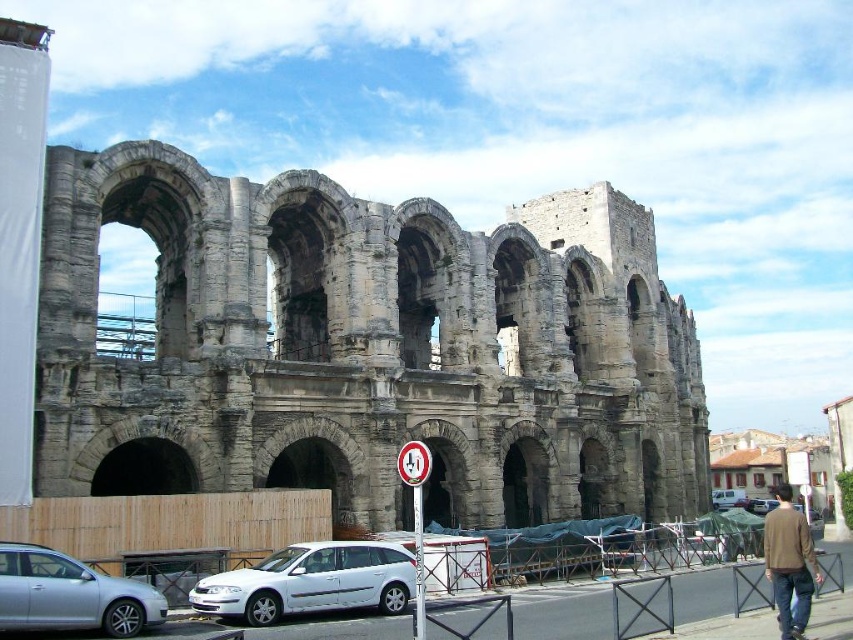
Question: Estimate the real-world distances between objects in this image. Which object is farther from the brown cotton shirt at lower right?

Choices:
 (A) silver metallic car at lower left
 (B) white matte car at lower center
 (C) white plastic sign at center
 (D) metallic reflective sign at center

Answer: (A)

Question: Which point appears closest to the camera in this image?

Choices:
 (A) (780, 572)
 (B) (654, 272)
 (C) (415, 476)
 (D) (715, 492)

Answer: (C)

Question: Does brown cotton shirt at lower right have a greater width compared to white plastic sign at center?

Choices:
 (A) no
 (B) yes

Answer: (B)

Question: Does brown cotton shirt at lower right have a larger size compared to metallic reflective sign at center?

Choices:
 (A) yes
 (B) no

Answer: (A)

Question: Does white plastic sign at center lie behind white matte van at center?

Choices:
 (A) no
 (B) yes

Answer: (A)

Question: Which point is closer to the camera?

Choices:
 (A) (416, 504)
 (B) (328, 237)
 (C) (790, 634)

Answer: (C)